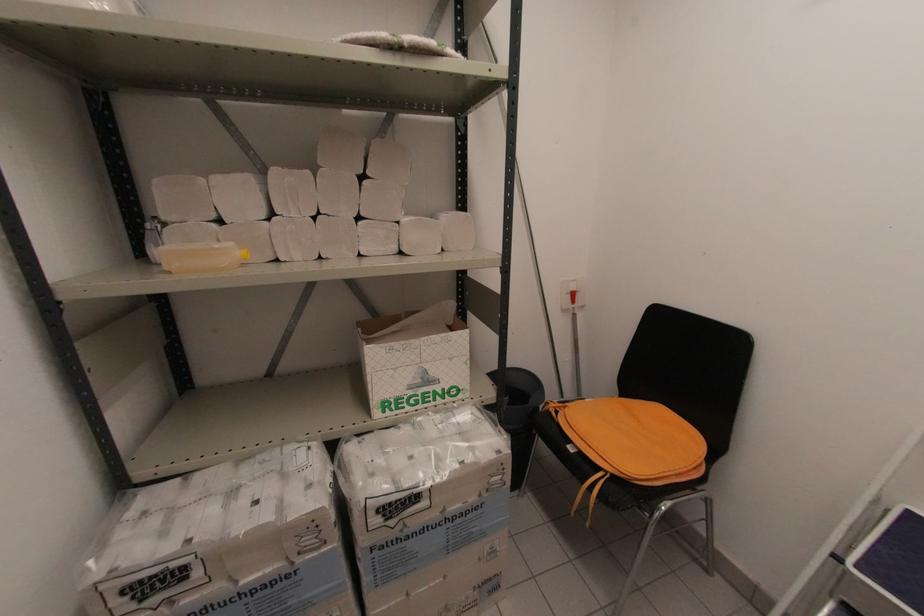
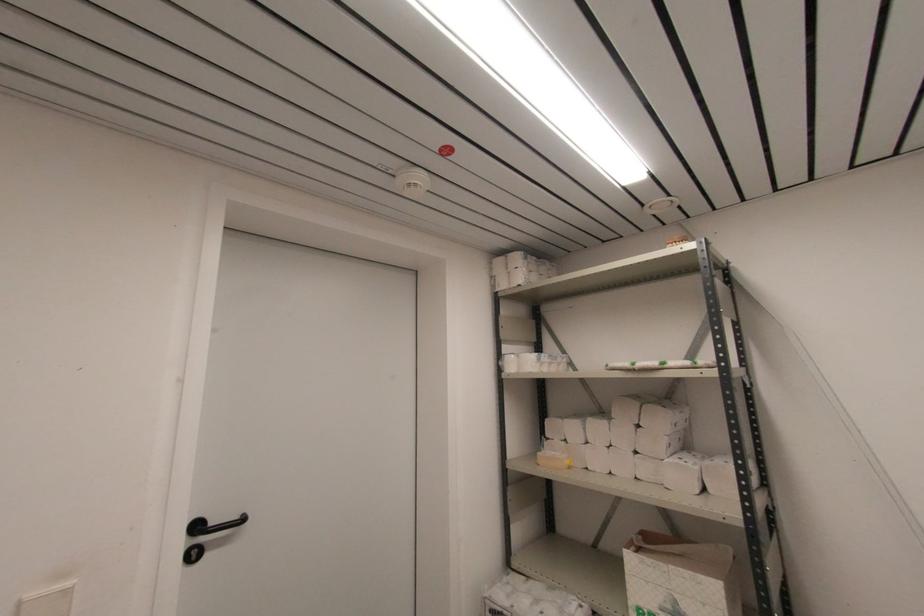
The point at (419, 381) is marked in the first image. Where is the corresponding point in the second image?

(671, 609)